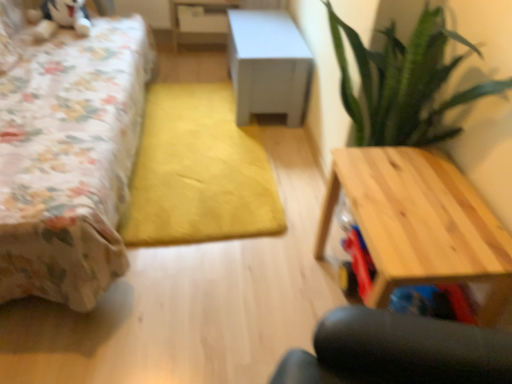
Find the location of a particular element. The height and width of the screenshot is (384, 512). white matte cabinet at center, positioned as the 2th table in back-to-front order is located at coordinates (268, 65).

Find the location of a particular element. The height and width of the screenshot is (384, 512). white matte cabinet at center, which is the second table from top to bottom is located at coordinates (268, 65).

Is floral fabric bed at left to the left or to the right of white matte cabinet at center, which ranks as the 2th table in bottom-to-top order, in the image?

From the image, it's evident that floral fabric bed at left is to the left of white matte cabinet at center, which ranks as the 2th table in bottom-to-top order.

Is floral fabric bed at left surrounding white matte cabinet at center, which is the second table from top to bottom?

Actually, white matte cabinet at center, which is the second table from top to bottom, is outside floral fabric bed at left.

Which of these two, floral fabric bed at left or white matte cabinet at center, which ranks as the 2th table in bottom-to-top order, stands shorter?

white matte cabinet at center, which ranks as the 2th table in bottom-to-top order, is shorter.

From a real-world perspective, which is physically above, floral fabric bed at left or white matte cabinet at center, which is the second table from top to bottom?

floral fabric bed at left.

Can you tell me how much light wood table at right, which is counted as the third table, starting from the top, and floral fabric bed at left differ in facing direction?

light wood table at right, which is counted as the third table, starting from the top, and floral fabric bed at left are facing 180 degrees away from each other.

Does light wood table at right, placed as the third table when sorted from back to front, have a greater height compared to floral fabric bed at left?

In fact, light wood table at right, placed as the third table when sorted from back to front, may be shorter than floral fabric bed at left.

From the image's perspective, does light wood table at right, the 1th table in the bottom-to-top sequence, appear higher than floral fabric bed at left?

No, from the image's perspective, light wood table at right, the 1th table in the bottom-to-top sequence, is not on top of floral fabric bed at left.

Is light wood table at right, which is counted as the third table, starting from the top, oriented away from floral fabric bed at left?

That's not correct — light wood table at right, which is counted as the third table, starting from the top, is not looking away from floral fabric bed at left.

Is white matte cabinet at center, which is the second table from top to bottom, thinner than floral fabric bed at left?

Indeed, white matte cabinet at center, which is the second table from top to bottom, has a lesser width compared to floral fabric bed at left.

From a real-world perspective, between white matte cabinet at center, positioned as the 2th table in back-to-front order, and floral fabric bed at left, who is vertically higher?

In real-world perspective, floral fabric bed at left is above.

How many degrees apart are the facing directions of white glossy table at upper center, placed as the third table when sorted from bottom to top, and white matte cabinet at center, which is the second table from top to bottom?

white glossy table at upper center, placed as the third table when sorted from bottom to top, and white matte cabinet at center, which is the second table from top to bottom, are facing 89.8 degrees away from each other.

Is the depth of white glossy table at upper center, placed as the third table when sorted from bottom to top, less than that of white matte cabinet at center, positioned as the 2th table in back-to-front order?

No, white glossy table at upper center, placed as the third table when sorted from bottom to top, is behind white matte cabinet at center, positioned as the 2th table in back-to-front order.

Considering the sizes of white glossy table at upper center, the third table in the front-to-back sequence, and white matte cabinet at center, positioned as the 2th table in back-to-front order, in the image, is white glossy table at upper center, the third table in the front-to-back sequence, bigger or smaller than white matte cabinet at center, positioned as the 2th table in back-to-front order,?

Clearly, white glossy table at upper center, the third table in the front-to-back sequence, is smaller in size than white matte cabinet at center, positioned as the 2th table in back-to-front order.

From the picture: From a real-world perspective, which object rests below the other?

In real-world perspective, white matte cabinet at center, positioned as the 2th table in back-to-front order, is lower.

From a real-world perspective, is white matte cabinet at center, positioned as the second table in front-to-back order, on light wood table at right, placed as the third table when sorted from back to front?

No, from a real-world perspective, white matte cabinet at center, positioned as the second table in front-to-back order, is not on top of light wood table at right, placed as the third table when sorted from back to front.

In terms of width, does white matte cabinet at center, which ranks as the 2th table in bottom-to-top order, look wider or thinner when compared to light wood table at right, the 1th table in the bottom-to-top sequence?

In the image, white matte cabinet at center, which ranks as the 2th table in bottom-to-top order, appears to be wider than light wood table at right, the 1th table in the bottom-to-top sequence.

Locate an element on the screen. This screenshot has height=384, width=512. table below the light wood table at right, the 1th table in the bottom-to-top sequence (from a real-world perspective) is located at coordinates (268, 65).

Is white matte cabinet at center, positioned as the 2th table in back-to-front order, with light wood table at right, which is counted as the third table, starting from the top?

No, white matte cabinet at center, positioned as the 2th table in back-to-front order, is not with light wood table at right, which is counted as the third table, starting from the top.

Measure the distance between floral fabric bed at left and light wood table at right, marked as the first table in a front-to-back arrangement.

They are 3.51 feet apart.

From a real-world perspective, between floral fabric bed at left and light wood table at right, the 1th table in the bottom-to-top sequence, who is vertically higher?

floral fabric bed at left, from a real-world perspective.

Consider the image. What's the angular difference between floral fabric bed at left and light wood table at right, the 1th table in the bottom-to-top sequence,'s facing directions?

floral fabric bed at left and light wood table at right, the 1th table in the bottom-to-top sequence, are facing 180 degrees away from each other.

Between floral fabric bed at left and light wood table at right, marked as the first table in a front-to-back arrangement, which one is positioned behind?

light wood table at right, marked as the first table in a front-to-back arrangement, is further away from the camera.

Which object is wider, white matte cabinet at center, positioned as the 2th table in back-to-front order, or white glossy table at upper center, the 1th table viewed from the top?

With larger width is white matte cabinet at center, positioned as the 2th table in back-to-front order.

Which point is more forward, (278, 48) or (203, 4)?

Point (278, 48)

Does white matte cabinet at center, which is the second table from top to bottom, have a lesser height compared to white glossy table at upper center, the third table in the front-to-back sequence?

No.

Which is in front, white matte cabinet at center, which ranks as the 2th table in bottom-to-top order, or white glossy table at upper center, acting as the 1th table starting from the back?

white matte cabinet at center, which ranks as the 2th table in bottom-to-top order.

Which table is the 2nd one when counting from the back of the floral fabric bed at left? Please provide its 2D coordinates.

[(268, 65)]

Where is `bed in front of the light wood table at right, marked as the first table in a front-to-back arrangement`? The image size is (512, 384). bed in front of the light wood table at right, marked as the first table in a front-to-back arrangement is located at coordinates (70, 159).

Looking at the image, which one is located closer to white matte cabinet at center, positioned as the 2th table in back-to-front order, floral fabric bed at left or white glossy table at upper center, acting as the 1th table starting from the back?

The object closer to white matte cabinet at center, positioned as the 2th table in back-to-front order, is white glossy table at upper center, acting as the 1th table starting from the back.

Considering their positions, is light wood table at right, which is counted as the third table, starting from the top, positioned further to white matte cabinet at center, positioned as the 2th table in back-to-front order, than white glossy table at upper center, acting as the 1th table starting from the back?

Based on the image, light wood table at right, which is counted as the third table, starting from the top, appears to be further to white matte cabinet at center, positioned as the 2th table in back-to-front order.

Looking at the image, which one is located further to light wood table at right, marked as the first table in a front-to-back arrangement, floral fabric bed at left or white glossy table at upper center, placed as the third table when sorted from bottom to top?

Among the two, white glossy table at upper center, placed as the third table when sorted from bottom to top, is located further to light wood table at right, marked as the first table in a front-to-back arrangement.

Considering their positions, is white glossy table at upper center, placed as the third table when sorted from bottom to top, positioned closer to floral fabric bed at left than white matte cabinet at center, positioned as the 2th table in back-to-front order?

white matte cabinet at center, positioned as the 2th table in back-to-front order, is closer to floral fabric bed at left.

Looking at the image, which one is located closer to white matte cabinet at center, positioned as the second table in front-to-back order, white glossy table at upper center, placed as the third table when sorted from bottom to top, or floral fabric bed at left?

white glossy table at upper center, placed as the third table when sorted from bottom to top, is closer to white matte cabinet at center, positioned as the second table in front-to-back order.

When comparing their distances from white glossy table at upper center, the third table in the front-to-back sequence, does floral fabric bed at left or white matte cabinet at center, which ranks as the 2th table in bottom-to-top order, seem further?

The object further to white glossy table at upper center, the third table in the front-to-back sequence, is floral fabric bed at left.

Looking at this image, when comparing their distances from white glossy table at upper center, acting as the 1th table starting from the back, does light wood table at right, marked as the first table in a front-to-back arrangement, or floral fabric bed at left seem further?

light wood table at right, marked as the first table in a front-to-back arrangement.

When comparing their distances from white matte cabinet at center, positioned as the 2th table in back-to-front order, does floral fabric bed at left or light wood table at right, placed as the third table when sorted from back to front, seem further?

Among the two, light wood table at right, placed as the third table when sorted from back to front, is located further to white matte cabinet at center, positioned as the 2th table in back-to-front order.

Find the location of `table located between light wood table at right, which is counted as the third table, starting from the top, and white glossy table at upper center, the third table in the front-to-back sequence, in the depth direction`. table located between light wood table at right, which is counted as the third table, starting from the top, and white glossy table at upper center, the third table in the front-to-back sequence, in the depth direction is located at coordinates (268, 65).